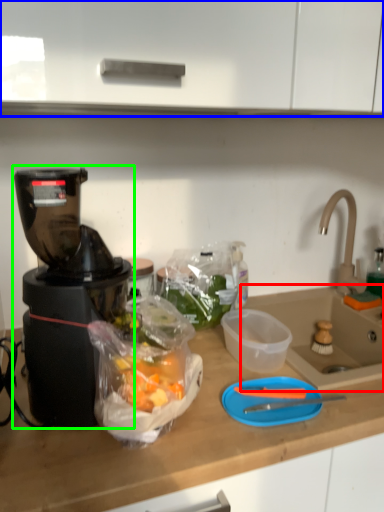
Question: Based on their relative distances, which object is nearer to sink (highlighted by a red box)? Choose from cabinetry (highlighted by a blue box) and blender (highlighted by a green box).

Choices:
 (A) cabinetry
 (B) blender

Answer: (B)